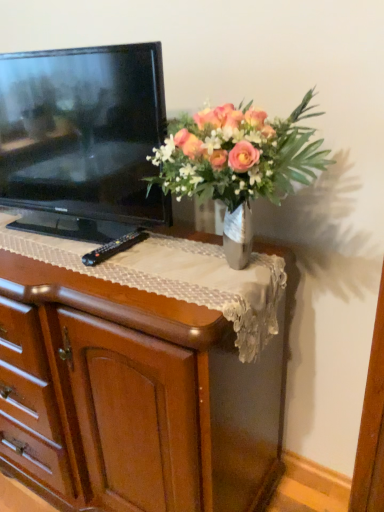
You are a GUI agent. You are given a task and a screenshot of the screen. Output one action in this format:
    pyautogui.click(x=<x>, y=<y>)
    Task: Click on the blank area to the left of metallic vase at upper center
    The image size is (384, 512).
    Given the screenshot: What is the action you would take?
    pyautogui.click(x=98, y=276)